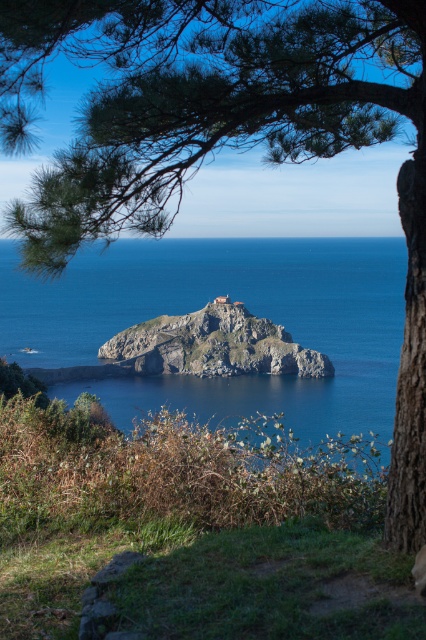
You are a photographer planning to capture the blue water at center and the brown rocky island at center in a single shot. Which object will occupy more of the frame in your photo?

The blue water at center will occupy more of the frame because it is bigger than the brown rocky island at center.

You are standing on the coast and see the blue water at center and the brown rocky island at center. Which object is positioned more to the right side of the scene?

The blue water at center is positioned more to the right side of the scene compared to the brown rocky island at center.

You are standing at the point marked by the coordinates point (232, 300). Based on the scene description, what is the immediate environment around you?

The point (232, 300) marks blue water at center, so you are standing in the blue water at center.